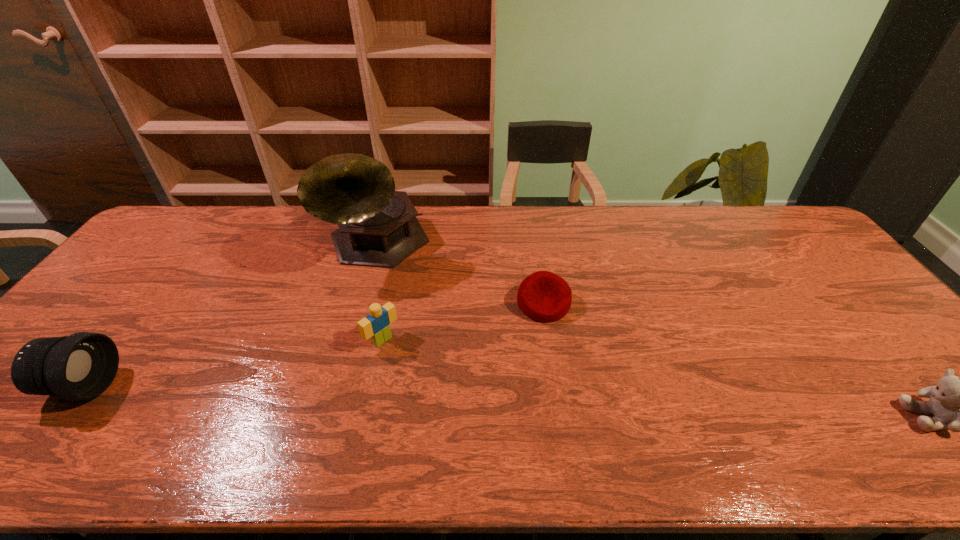
This screenshot has height=540, width=960. Identify the location of empty location between the tallest object and the fourth shortest object. (230, 316).

Identify which object is the second closest to the tallest object. Please provide its 2D coordinates. Your answer should be formatted as a tuple, i.e. [(x, y)], where the tuple contains the x and y coordinates of a point satisfying the conditions above.

[(543, 296)]

This screenshot has width=960, height=540. Find the location of `object that is the fourth closest to the telephoto lens`. object that is the fourth closest to the telephoto lens is located at coordinates (959, 404).

Find the location of a particular element. The height and width of the screenshot is (540, 960). vacant space that satisfies the following two spatial constraints: 1. on the front side of the Lego; 2. on the left side of the phonograph record is located at coordinates (351, 340).